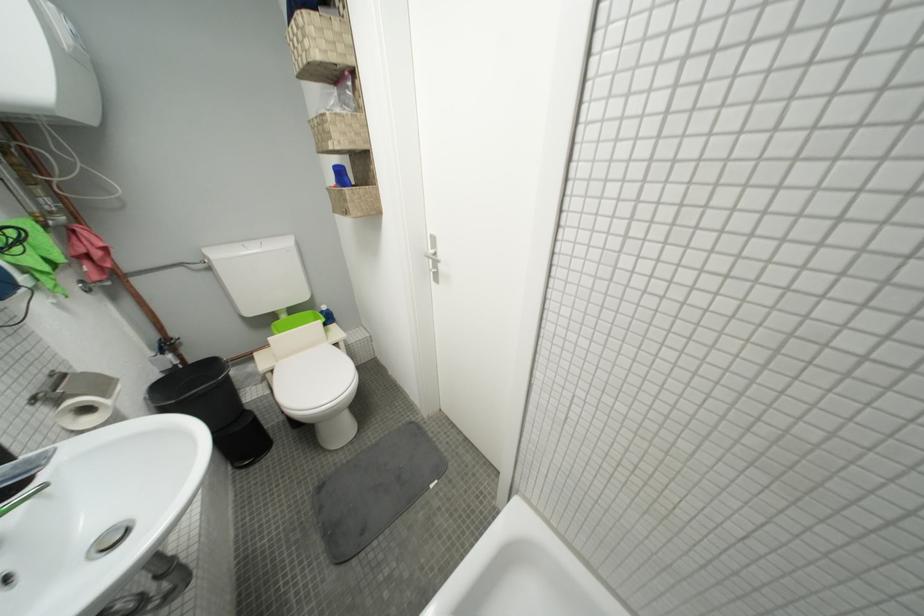
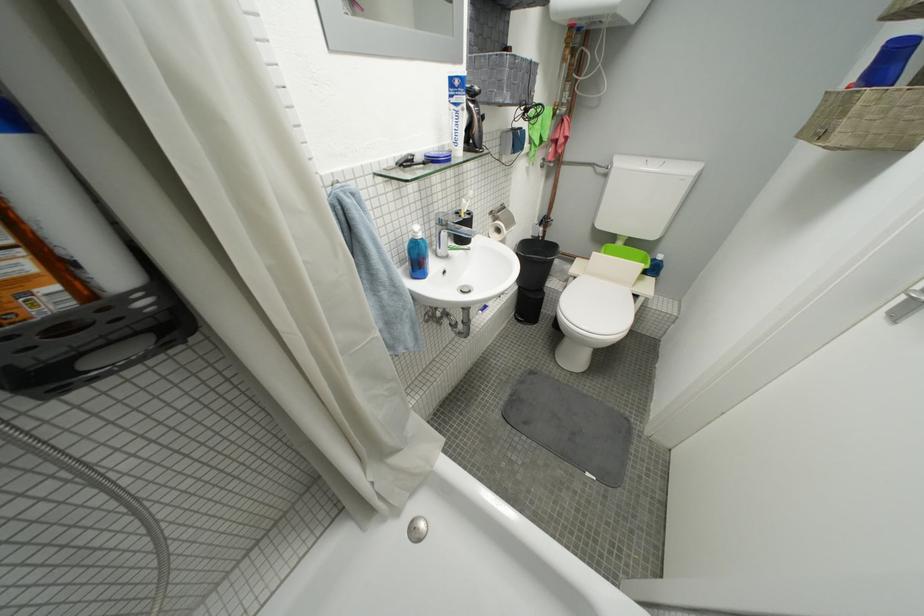
Where in the second image is the point corresponding to pixel 281 373 from the first image?

(584, 281)